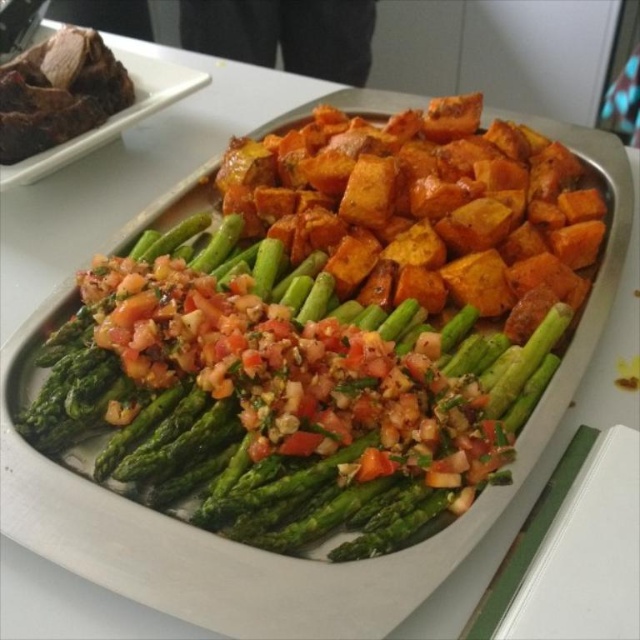
You are a food critic evaluating the portion sizes of the dish. Which component, the green glossy asparagus at center or the dark brown meat at upper left, has a larger portion size?

The green glossy asparagus at center has a larger portion size than the dark brown meat at upper left.

You are a food critic standing 10 feet away from the dish. You want to reach both the green glossy asparagus at center and the dark brown meat at upper left with your fork. Which component will require you to reach further?

The dark brown meat at upper left requires reaching further because it is 23.43 inches away from the green glossy asparagus at center, so the dark brown meat at upper left is farther from your current position than the green glossy asparagus at center.

Looking at the dish, where is the green glossy asparagus at center located in relation to the dark brown meat at upper left?

The green glossy asparagus at center is to the right of the dark brown meat at upper left.